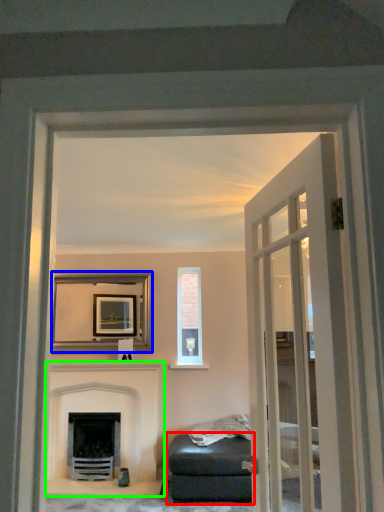
Question: Which object is the closest to the studio couch (highlighted by a red box)? Choose among these: picture frame (highlighted by a blue box) or fireplace (highlighted by a green box).

Choices:
 (A) picture frame
 (B) fireplace

Answer: (B)